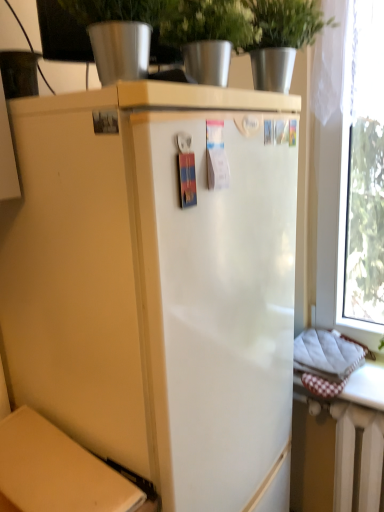
Question: Should I look upward or downward to see metallic silver pot at upper center?

Choices:
 (A) down
 (B) up

Answer: (B)

Question: Is transparent glass window at right facing towards white painted metal radiator at lower right?

Choices:
 (A) yes
 (B) no

Answer: (B)

Question: Would you say transparent glass window at right contains white painted metal radiator at lower right?

Choices:
 (A) no
 (B) yes

Answer: (A)

Question: From the image's perspective, does transparent glass window at right appear lower than white painted metal radiator at lower right?

Choices:
 (A) yes
 (B) no

Answer: (B)

Question: From a real-world perspective, is transparent glass window at right beneath white painted metal radiator at lower right?

Choices:
 (A) no
 (B) yes

Answer: (A)

Question: Does transparent glass window at right have a greater width compared to white painted metal radiator at lower right?

Choices:
 (A) yes
 (B) no

Answer: (A)

Question: Does transparent glass window at right touch white painted metal radiator at lower right?

Choices:
 (A) yes
 (B) no

Answer: (B)

Question: Is transparent glass window at right outside matte cardboard box at lower left?

Choices:
 (A) no
 (B) yes

Answer: (B)

Question: Does transparent glass window at right have a smaller size compared to matte cardboard box at lower left?

Choices:
 (A) yes
 (B) no

Answer: (B)

Question: Considering the relative positions of transparent glass window at right and matte cardboard box at lower left in the image provided, is transparent glass window at right to the left of matte cardboard box at lower left from the viewer's perspective?

Choices:
 (A) no
 (B) yes

Answer: (A)

Question: Is transparent glass window at right aimed at matte cardboard box at lower left?

Choices:
 (A) yes
 (B) no

Answer: (A)

Question: Does transparent glass window at right come in front of matte cardboard box at lower left?

Choices:
 (A) no
 (B) yes

Answer: (A)

Question: Is transparent glass window at right not close to matte cardboard box at lower left?

Choices:
 (A) yes
 (B) no

Answer: (A)

Question: Could you tell me if metallic silver pot at upper center is facing transparent glass window at right?

Choices:
 (A) no
 (B) yes

Answer: (A)